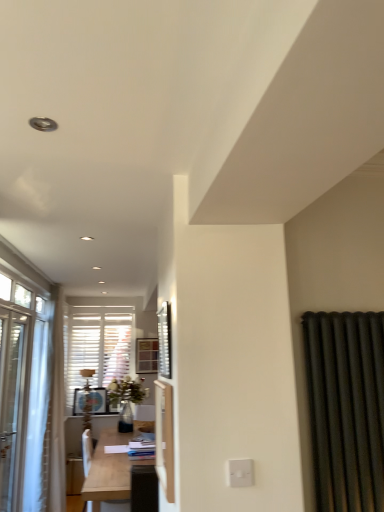
Question: Is white glossy screen door at center not close to metallic silver window screen at center?

Choices:
 (A) yes
 (B) no

Answer: (B)

Question: From a real-world perspective, is white glossy screen door at center physically below metallic silver window screen at center?

Choices:
 (A) no
 (B) yes

Answer: (B)

Question: Considering the relative sizes of white glossy screen door at center and metallic silver window screen at center in the image provided, is white glossy screen door at center smaller than metallic silver window screen at center?

Choices:
 (A) no
 (B) yes

Answer: (A)

Question: Does white glossy screen door at center appear on the right side of metallic silver window screen at center?

Choices:
 (A) no
 (B) yes

Answer: (A)

Question: Does white glossy screen door at center come in front of metallic silver window screen at center?

Choices:
 (A) yes
 (B) no

Answer: (A)

Question: Is white glossy screen door at center wider or thinner than white plastic switch at lower center?

Choices:
 (A) thin
 (B) wide

Answer: (B)

Question: From the image's perspective, is white glossy screen door at center located above or below white plastic switch at lower center?

Choices:
 (A) above
 (B) below

Answer: (B)

Question: In the image, is white glossy screen door at center positioned in front of or behind white plastic switch at lower center?

Choices:
 (A) behind
 (B) front

Answer: (A)

Question: Considering the positions of white glossy screen door at center and white plastic switch at lower center in the image, is white glossy screen door at center taller or shorter than white plastic switch at lower center?

Choices:
 (A) short
 (B) tall

Answer: (B)

Question: From a real-world perspective, relative to white plastic switch at lower center, is metallic silver window screen at center vertically above or below?

Choices:
 (A) below
 (B) above

Answer: (B)

Question: From the image's perspective, is metallic silver window screen at center above or below white plastic switch at lower center?

Choices:
 (A) above
 (B) below

Answer: (A)

Question: Considering the positions of point (167, 320) and point (228, 474), is point (167, 320) closer or farther from the camera than point (228, 474)?

Choices:
 (A) closer
 (B) farther

Answer: (B)

Question: Considering the positions of metallic silver window screen at center and white plastic switch at lower center in the image, is metallic silver window screen at center wider or thinner than white plastic switch at lower center?

Choices:
 (A) thin
 (B) wide

Answer: (B)

Question: In terms of height, does light wood table at center look taller or shorter compared to metallic silver window screen at center?

Choices:
 (A) tall
 (B) short

Answer: (A)

Question: Does point (92, 493) appear closer or farther from the camera than point (167, 301)?

Choices:
 (A) closer
 (B) farther

Answer: (B)